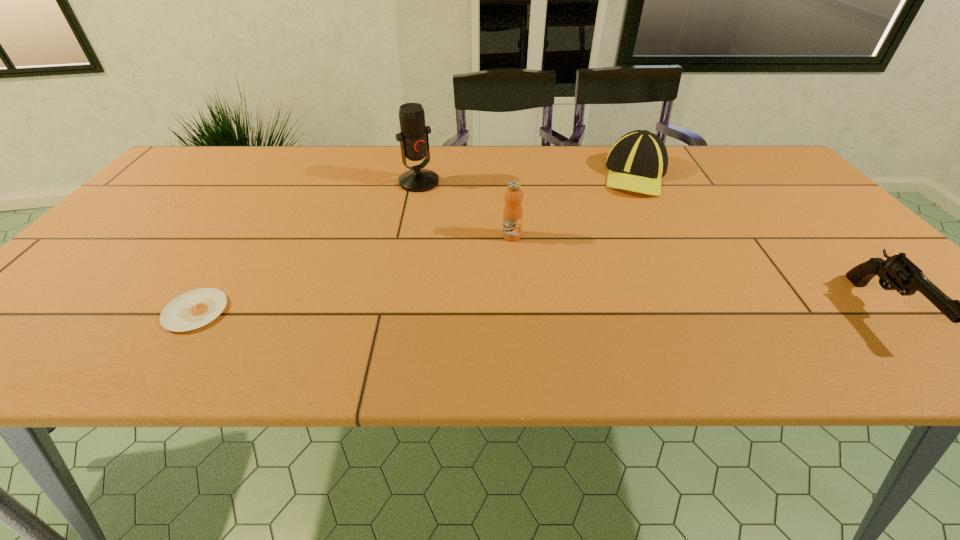
Where is `egg yolk located in the near edge section of the desktop`? Image resolution: width=960 pixels, height=540 pixels. egg yolk located in the near edge section of the desktop is located at coordinates (194, 309).

Locate an element on the screen. This screenshot has width=960, height=540. gun at the near edge is located at coordinates (898, 271).

I want to click on object that is at the right edge, so click(x=898, y=271).

Find the location of a particular element. This screenshot has width=960, height=540. object that is positioned at the near right corner is located at coordinates (898, 271).

Locate an element on the screen. vacant space at the far edge is located at coordinates (570, 167).

You are a GUI agent. You are given a task and a screenshot of the screen. Output one action in this format:
    pyautogui.click(x=<x>, y=<y>)
    Task: Click on the vacant area at the near edge
    
    Given the screenshot: What is the action you would take?
    pyautogui.click(x=797, y=315)

Find the location of `vacant space at the left edge of the desktop`. vacant space at the left edge of the desktop is located at coordinates (185, 200).

At what (x,y) coordinates should I click in order to perform the action: click on vacant region at the right edge. Please return your answer as a coordinate pair (x, y). The image size is (960, 540). Looking at the image, I should click on (820, 222).

The image size is (960, 540). In order to click on vacant area at the far left corner in this screenshot , I will do `click(198, 149)`.

Find the location of a particular element. The image size is (960, 540). blank space at the far right corner of the desktop is located at coordinates (728, 154).